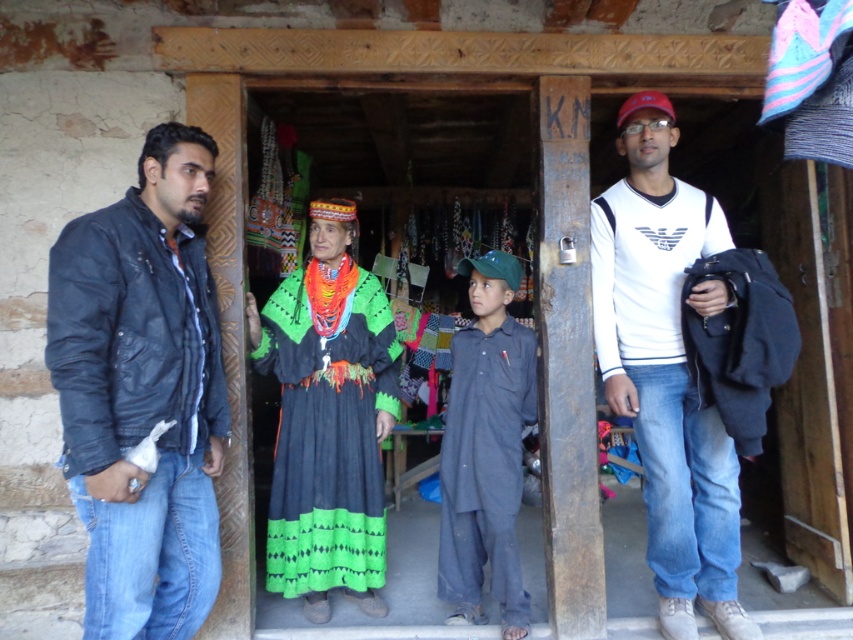
Question: Which point is farther to the camera?

Choices:
 (A) leather jacket at left
 (B) dark blue cotton shirt at center

Answer: (B)

Question: Is multicolored woven dress at center positioned at the back of dark blue cotton shirt at center?

Choices:
 (A) yes
 (B) no

Answer: (A)

Question: In this image, where is white cotton t-shirt at center located relative to multicolored woven dress at center?

Choices:
 (A) right
 (B) left

Answer: (A)

Question: Which object is closer to the camera taking this photo?

Choices:
 (A) multicolored woven dress at center
 (B) white cotton t-shirt at center
 (C) dark blue cotton shirt at center

Answer: (B)

Question: Is the position of multicolored woven dress at center less distant than that of dark blue cotton shirt at center?

Choices:
 (A) yes
 (B) no

Answer: (B)

Question: Which point is farther to the camera?

Choices:
 (A) leather jacket at left
 (B) dark blue cotton shirt at center

Answer: (B)